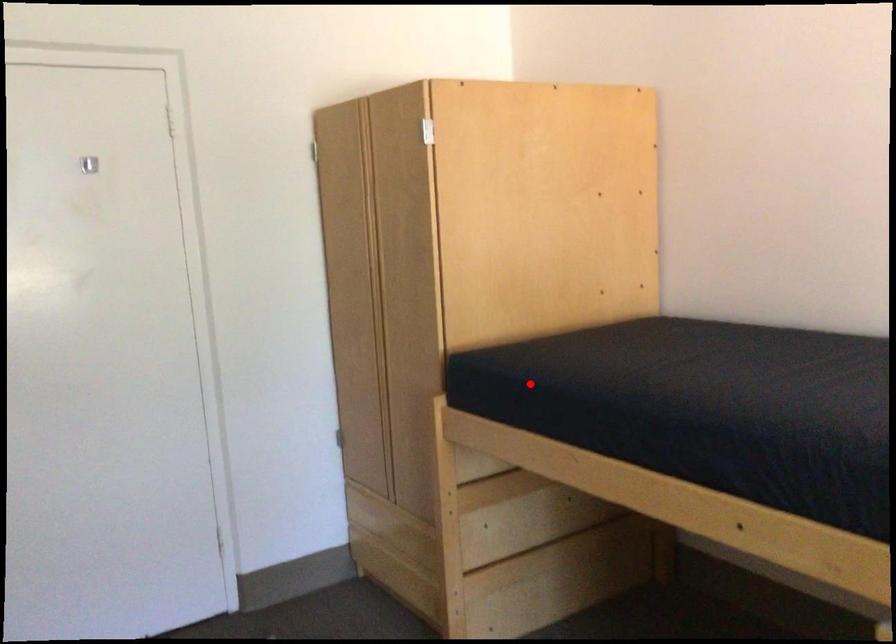
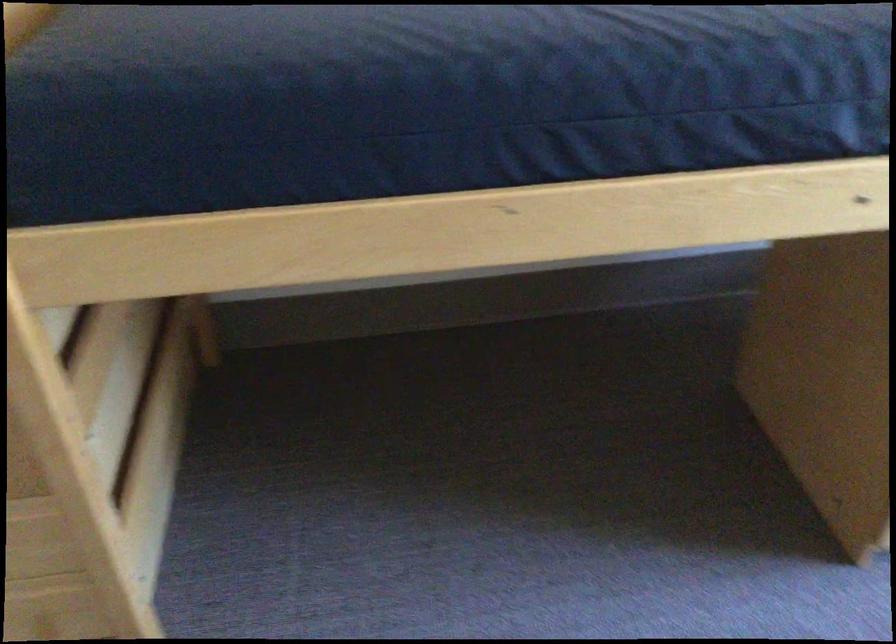
Locate, in the second image, the point that corresponds to the highlighted location in the first image.

(280, 106)